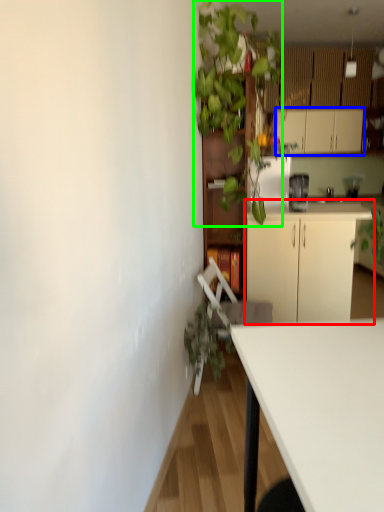
Question: Which is farther away from cabinetry (highlighted by a red box)? cabinetry (highlighted by a blue box) or vegetation (highlighted by a green box)?

Choices:
 (A) cabinetry
 (B) vegetation

Answer: (A)